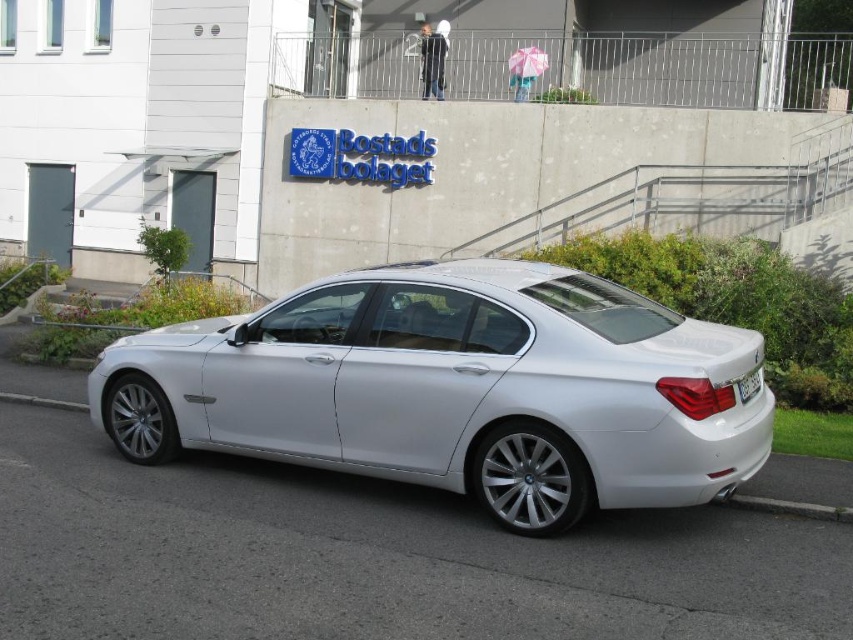
In the scene shown: You are a delivery driver who needs to unload a package from your truck. You see the gray concrete curb at lower right and the white plastic license plate at rear. Which object is shorter in height?

The gray concrete curb at lower right is shorter in height compared to the white plastic license plate at rear.

You are a delivery driver who needs to park your van next to the sleek silver sedan at center and the gray concrete curb at lower right. Based on their sizes, which vehicle or object should you avoid parking too close to due to its larger width?

The sleek silver sedan at center has a larger width than the gray concrete curb at lower right, so you should avoid parking too close to the sleek silver sedan at center to accommodate its size.

You are a delivery driver who needs to park your vehicle in the parking spot next to the gray concrete curb at lower right. However, there is a white plastic license plate at rear blocking the entrance. Can you drive around the obstruction to access the parking spot?

The gray concrete curb at lower right is to the right of the white plastic license plate at rear, so you can drive around the obstruction on the left side to access the parking spot.